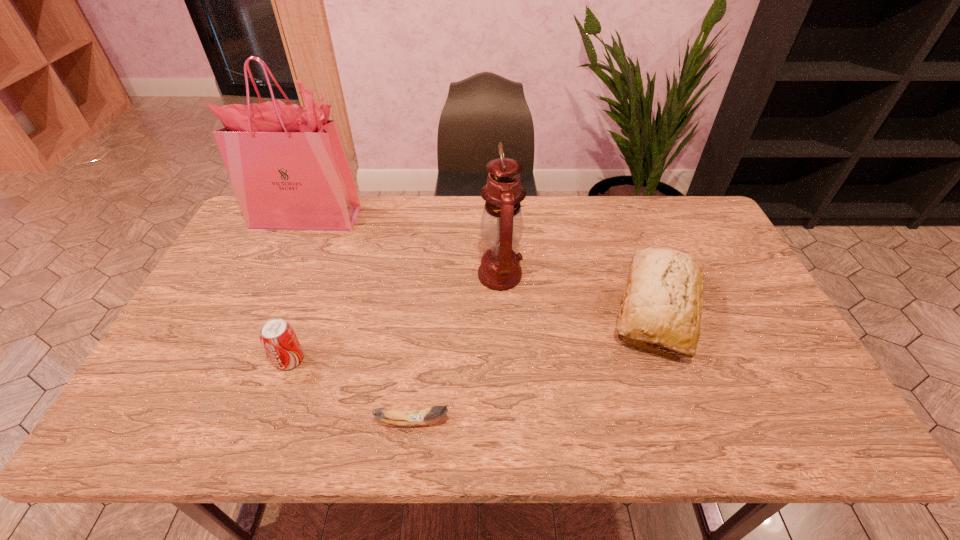
Identify the location of free point at the far right corner. The height and width of the screenshot is (540, 960). (721, 239).

Find the location of a particular element. The width and height of the screenshot is (960, 540). free space between the bread and the soda is located at coordinates (473, 334).

Locate an element on the screen. This screenshot has height=540, width=960. vacant space that is in between the banana and the rightmost object is located at coordinates (535, 366).

At what (x,y) coordinates should I click in order to perform the action: click on vacant space in between the shortest object and the rightmost object. Please return your answer as a coordinate pair (x, y). The width and height of the screenshot is (960, 540). Looking at the image, I should click on (535, 366).

Identify the location of vacant point located between the banana and the oil lamp. This screenshot has width=960, height=540. (457, 348).

Identify the location of free space between the tallest object and the soda. (299, 288).

The width and height of the screenshot is (960, 540). Find the location of `free spot between the second tallest object and the soda`. free spot between the second tallest object and the soda is located at coordinates (395, 318).

This screenshot has width=960, height=540. In order to click on vacant area that lies between the bread and the soda in this screenshot , I will do `click(473, 334)`.

Locate an element on the screen. This screenshot has width=960, height=540. free space between the banana and the bread is located at coordinates (535, 366).

Image resolution: width=960 pixels, height=540 pixels. What are the coordinates of `unoccupied position between the fourth shortest object and the rightmost object` in the screenshot? It's located at pos(578,292).